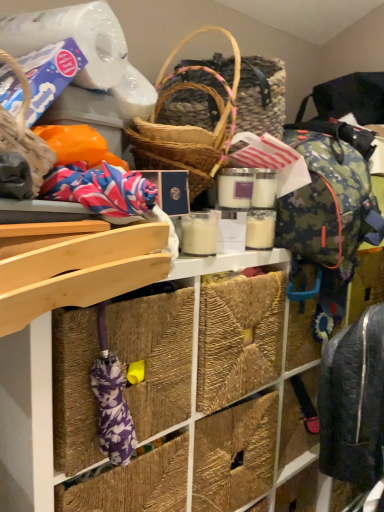
Question: Considering the relative sizes of natural fiber baskets at upper center and dark gray quilted backpack at lower right in the image provided, is natural fiber baskets at upper center thinner than dark gray quilted backpack at lower right?

Choices:
 (A) yes
 (B) no

Answer: (B)

Question: Considering the relative sizes of natural fiber baskets at upper center and dark gray quilted backpack at lower right in the image provided, is natural fiber baskets at upper center taller than dark gray quilted backpack at lower right?

Choices:
 (A) yes
 (B) no

Answer: (A)

Question: From a real-world perspective, is natural fiber baskets at upper center on top of dark gray quilted backpack at lower right?

Choices:
 (A) yes
 (B) no

Answer: (B)

Question: Is natural fiber baskets at upper center shorter than dark gray quilted backpack at lower right?

Choices:
 (A) yes
 (B) no

Answer: (B)

Question: Is natural fiber baskets at upper center next to dark gray quilted backpack at lower right and touching it?

Choices:
 (A) no
 (B) yes

Answer: (A)

Question: Does natural fiber baskets at upper center turn towards dark gray quilted backpack at lower right?

Choices:
 (A) yes
 (B) no

Answer: (A)

Question: Is dark gray quilted backpack at lower right taller than natural fiber baskets at upper center?

Choices:
 (A) no
 (B) yes

Answer: (A)

Question: Does dark gray quilted backpack at lower right have a lesser height compared to natural fiber baskets at upper center?

Choices:
 (A) no
 (B) yes

Answer: (B)

Question: Is the position of dark gray quilted backpack at lower right more distant than that of natural fiber baskets at upper center?

Choices:
 (A) no
 (B) yes

Answer: (B)

Question: From the image's perspective, is dark gray quilted backpack at lower right above natural fiber baskets at upper center?

Choices:
 (A) no
 (B) yes

Answer: (B)

Question: Does dark gray quilted backpack at lower right have a larger size compared to natural fiber baskets at upper center?

Choices:
 (A) yes
 (B) no

Answer: (B)

Question: Is dark gray quilted backpack at lower right next to natural fiber baskets at upper center and touching it?

Choices:
 (A) yes
 (B) no

Answer: (B)

Question: In terms of height, does natural fiber baskets at upper center look taller or shorter compared to dark gray quilted backpack at lower right?

Choices:
 (A) short
 (B) tall

Answer: (B)